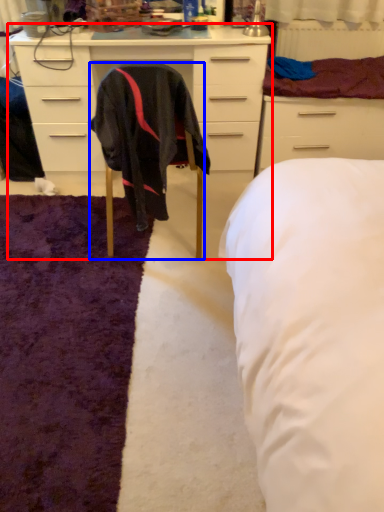
Question: Which object appears closest to the camera in this image, cabinetry (highlighted by a red box) or chair (highlighted by a blue box)?

Choices:
 (A) cabinetry
 (B) chair

Answer: (B)